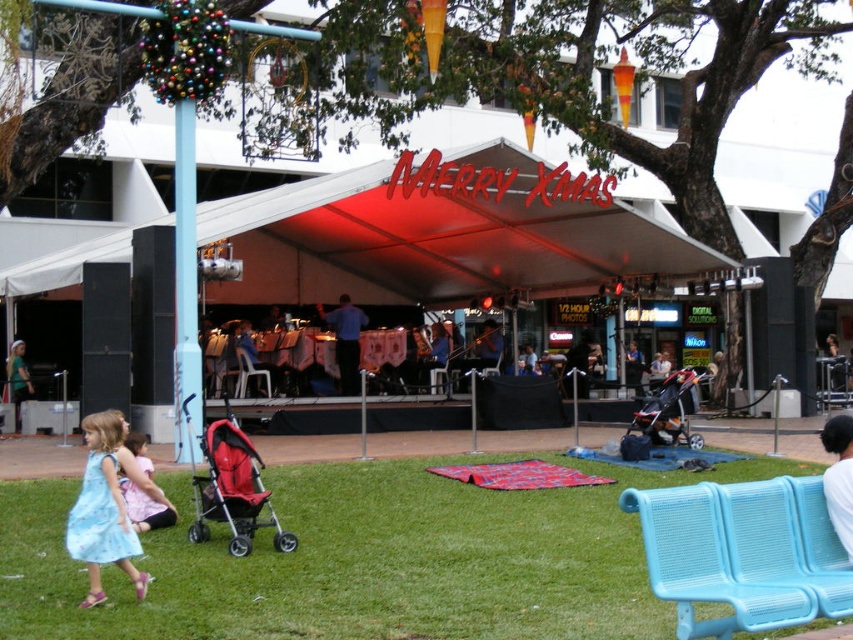
Question: Observing the image, what is the correct spatial positioning of light blue satin dress at lower left in reference to red fabric stroller at center?

Choices:
 (A) right
 (B) left

Answer: (B)

Question: Which point is closer to the camera?

Choices:
 (A) [672, 444]
 (B) [15, 422]

Answer: (A)

Question: Does green grass at lower center appear under red fabric stroller at center?

Choices:
 (A) no
 (B) yes

Answer: (B)

Question: Which point is closer to the camera?

Choices:
 (A) light blue dress at lower left
 (B) blue shirt at stage center

Answer: (A)

Question: Estimate the real-world distances between objects in this image. Which object is closer to the green fabric dress at lower left?

Choices:
 (A) blue plastic bench at lower right
 (B) orange fabric stroller at center

Answer: (B)

Question: Can you confirm if light blue cotton dress at lower left is positioned to the left of blue shirt at stage center?

Choices:
 (A) no
 (B) yes

Answer: (A)